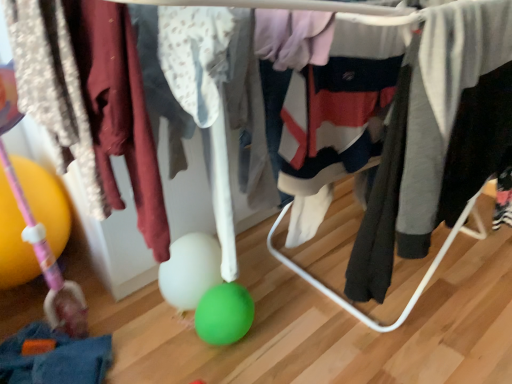
Describe the element at coordinates (195, 56) in the screenshot. I see `light gray dotted fabric at center` at that location.

I want to click on light gray dotted fabric at center, so pyautogui.click(x=195, y=56).

You are a GUI agent. You are given a task and a screenshot of the screen. Output one action in this format:
    pyautogui.click(x=<x>, y=<y>)
    Task: Click on the light gray dotted fabric at center
    This screenshot has height=384, width=512.
    Given the screenshot: What is the action you would take?
    pyautogui.click(x=195, y=56)